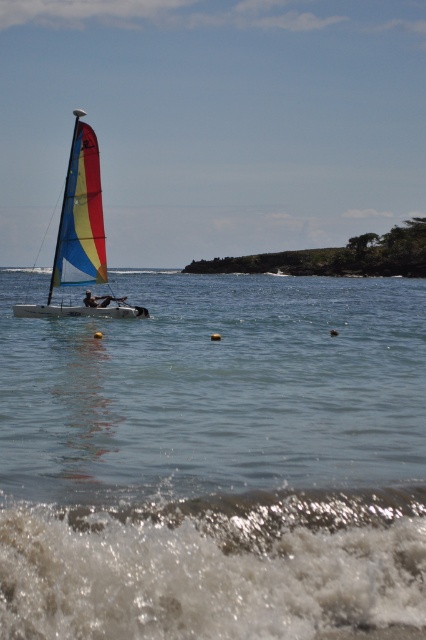
Question: Is clear water at center closer to the viewer compared to white frothy wave at lower center?

Choices:
 (A) yes
 (B) no

Answer: (B)

Question: In this image, where is white frothy wave at lower center located relative to matte sailboat at left?

Choices:
 (A) above
 (B) below

Answer: (B)

Question: Which point is closer to the camera?

Choices:
 (A) white frothy wave at lower center
 (B) clear water at center

Answer: (A)

Question: Does white frothy wave at lower center have a greater width compared to matte sailboat at left?

Choices:
 (A) yes
 (B) no

Answer: (B)

Question: Which object is farther from the camera taking this photo?

Choices:
 (A) white frothy wave at lower center
 (B) clear water at center
 (C) matte sailboat at left

Answer: (C)

Question: Which point appears farthest from the camera in this image?

Choices:
 (A) (184, 284)
 (B) (74, 275)

Answer: (A)